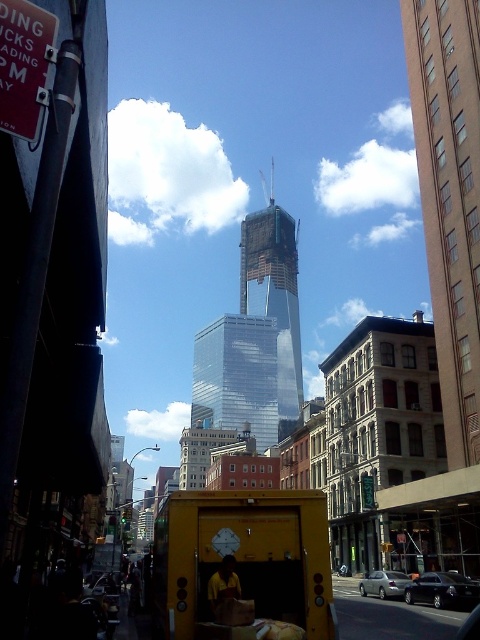
Can you confirm if glassy steel skyscraper at center is wider than shiny black sedan at center?

Indeed, glassy steel skyscraper at center has a greater width compared to shiny black sedan at center.

Does glassy steel skyscraper at center appear under shiny black sedan at center?

No, glassy steel skyscraper at center is not below shiny black sedan at center.

Which is in front, point (285, 225) or point (431, 586)?

Positioned in front is point (431, 586).

Find the location of a particular element. glassy steel skyscraper at center is located at coordinates [275, 292].

How distant is brown brick building at upper right from shiny black sedan at center?

The distance of brown brick building at upper right from shiny black sedan at center is 63.16 feet.

Find the location of a particular element. brown brick building at upper right is located at coordinates (450, 198).

What do you see at coordinates (450, 198) in the screenshot?
I see `brown brick building at upper right` at bounding box center [450, 198].

Where is `brown brick building at upper right`? brown brick building at upper right is located at coordinates (450, 198).

How far apart are brown brick building at upper right and glassy steel skyscraper at center?

brown brick building at upper right and glassy steel skyscraper at center are 263.70 meters apart from each other.

Is point (439, 378) farther from viewer compared to point (294, 288)?

No, it is not.

Identify the location of brown brick building at upper right. This screenshot has height=640, width=480. (450, 198).